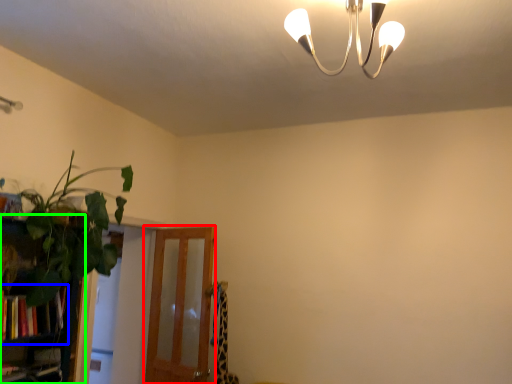
Question: Which is farther away from screen door (highlighted by a red box)? book (highlighted by a blue box) or bookshelf (highlighted by a green box)?

Choices:
 (A) book
 (B) bookshelf

Answer: (A)